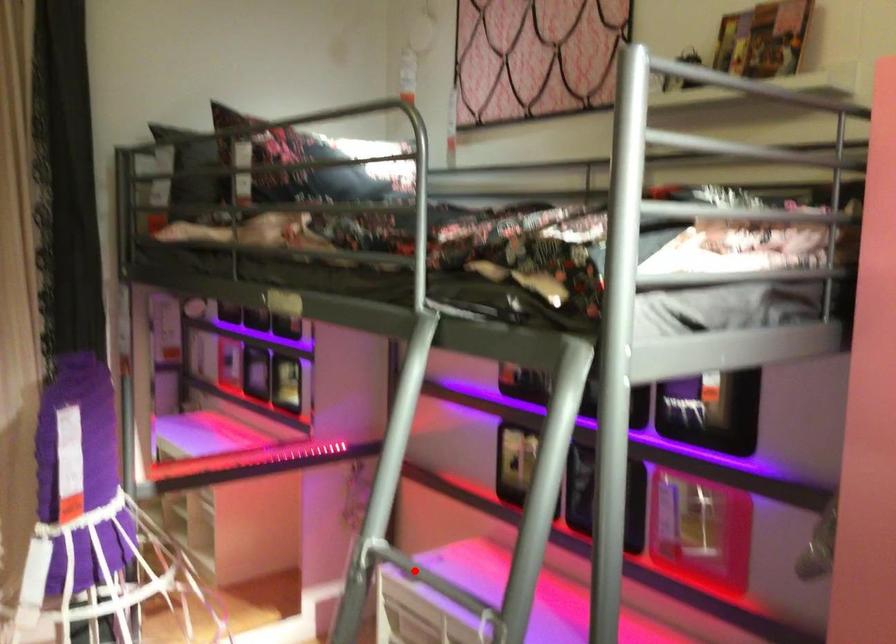
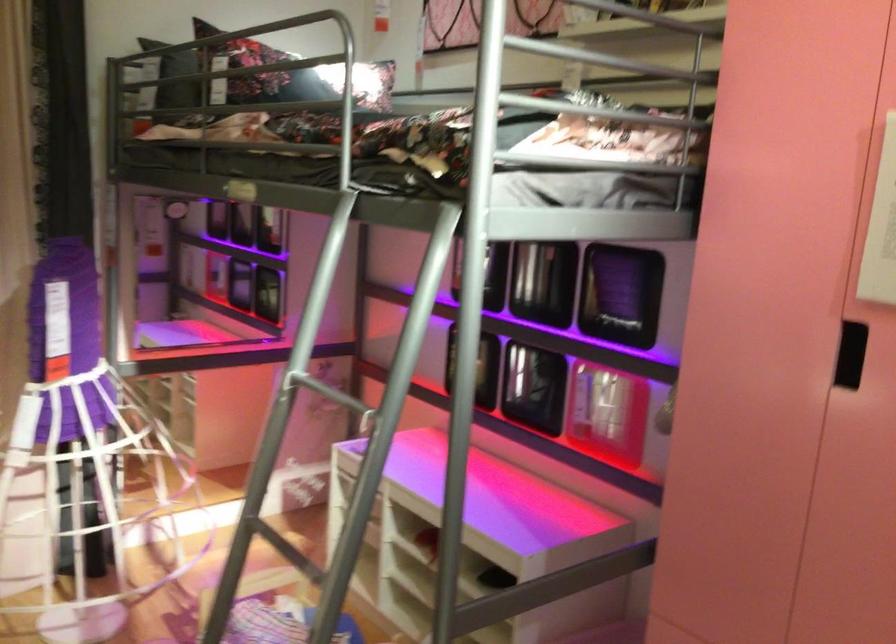
Question: I am providing you with two images of the same scene from different viewpoints. A red point is marked on the first image. Is the red point's position out of view in image 2?

Choices:
 (A) Yes
 (B) No

Answer: (B)